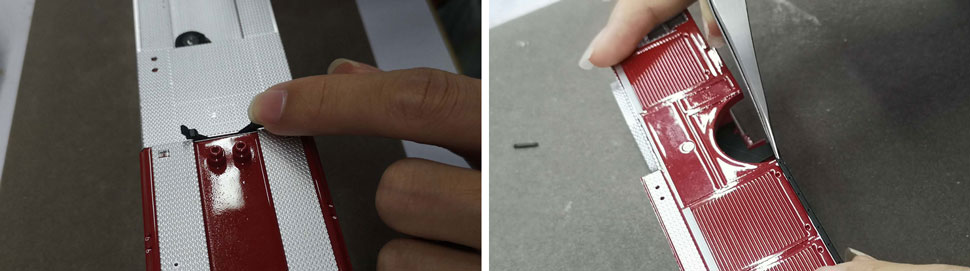
You are a GUI agent. You are given a task and a screenshot of the screen. Output one action in this format:
    pyautogui.click(x=<x>, y=<y>)
    Task: Click on the table
    Image resolution: width=970 pixels, height=271 pixels.
    Given the screenshot: What is the action you would take?
    pyautogui.click(x=68, y=135), pyautogui.click(x=826, y=102), pyautogui.click(x=585, y=193)